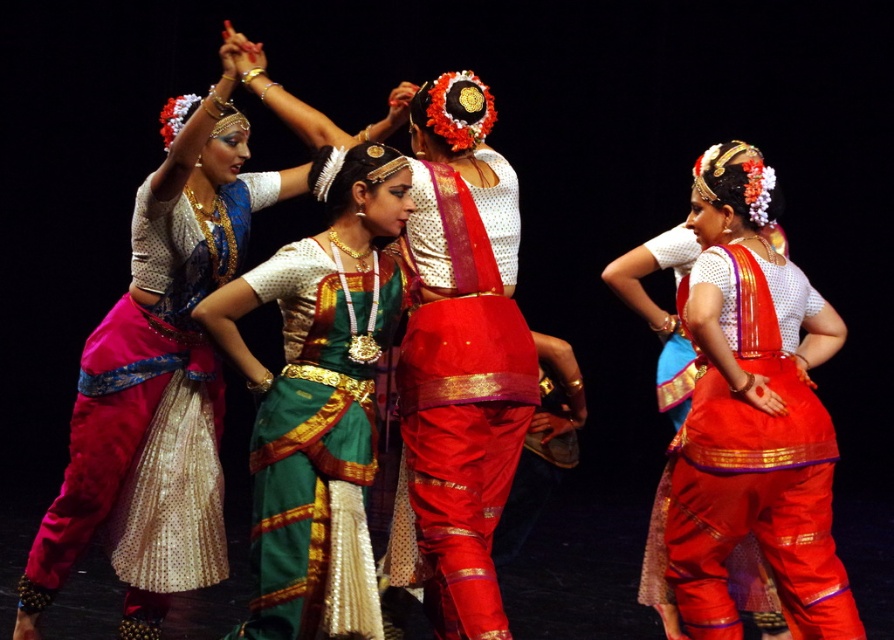
Question: Which object appears closest to the camera in this image?

Choices:
 (A) matte gold blouse at center
 (B) shiny red saree at center

Answer: (B)

Question: Which object is farther from the camera taking this photo?

Choices:
 (A) matte gold blouse at center
 (B) pink sequined skirt at left
 (C) shiny red fabric saree at right
 (D) shiny red saree at center

Answer: (B)

Question: In this image, where is matte gold blouse at center located relative to shiny red fabric saree at right?

Choices:
 (A) left
 (B) right

Answer: (A)

Question: Is pink sequined skirt at left to the right of shiny red saree at center from the viewer's perspective?

Choices:
 (A) no
 (B) yes

Answer: (A)

Question: Can you confirm if pink sequined skirt at left is smaller than shiny red saree at center?

Choices:
 (A) no
 (B) yes

Answer: (A)

Question: Among these objects, which one is farthest from the camera?

Choices:
 (A) pink sequined skirt at left
 (B) green silk saree at center
 (C) matte gold blouse at center

Answer: (A)